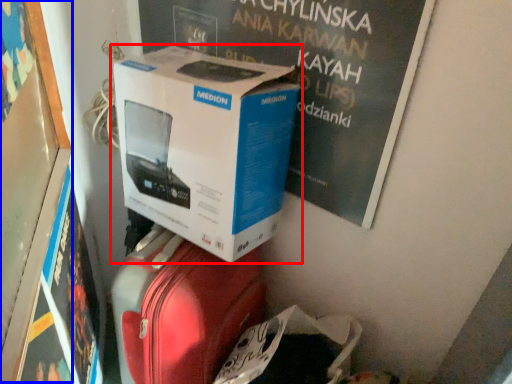
Question: Which object appears closest to the camera in this image, box (highlighted by a red box) or bulletin board (highlighted by a blue box)?

Choices:
 (A) box
 (B) bulletin board

Answer: (B)